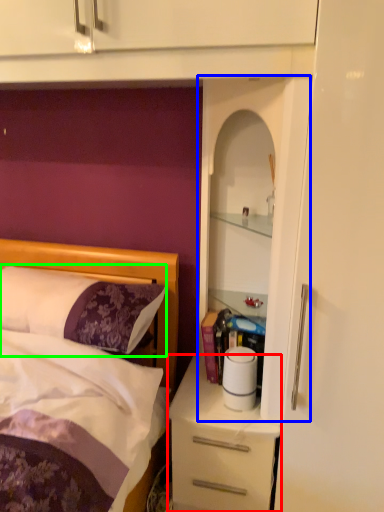
Question: Which object is the closest to the desk (highlighted by a red box)? Choose among these: cabinet (highlighted by a blue box) or pillow (highlighted by a green box).

Choices:
 (A) cabinet
 (B) pillow

Answer: (A)